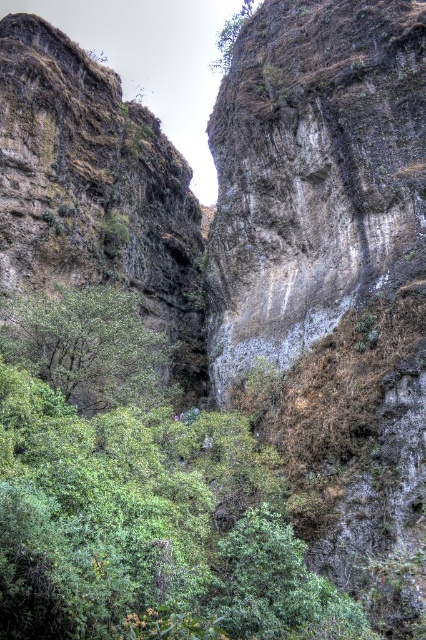
Question: Which object is the farthest from the green leafy tree at upper center?

Choices:
 (A) rough stone rock face at center
 (B) green leafy tree at center

Answer: (B)

Question: Estimate the real-world distances between objects in this image. Which object is farther from the rough textured rock at left?

Choices:
 (A) green leafy tree at upper center
 (B) rough stone rock face at center
 (C) green leafy tree at center

Answer: (A)

Question: Is rough textured rock at left to the right of green leafy tree at upper center from the viewer's perspective?

Choices:
 (A) no
 (B) yes

Answer: (A)

Question: Does rough stone rock face at center appear on the left side of green leafy tree at center?

Choices:
 (A) no
 (B) yes

Answer: (A)

Question: Is green leafy tree at center bigger than green leafy tree at upper center?

Choices:
 (A) no
 (B) yes

Answer: (A)

Question: Estimate the real-world distances between objects in this image. Which object is farther from the rough stone rock face at center?

Choices:
 (A) green leafy tree at center
 (B) green leafy tree at upper center
 (C) rough textured rock at left

Answer: (B)